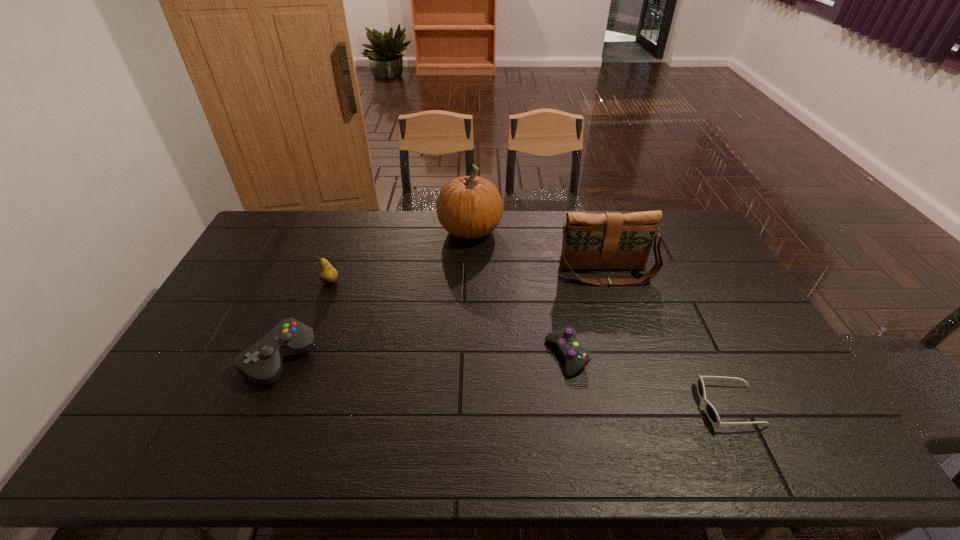
This screenshot has width=960, height=540. In order to click on free space located on the left of the pear in this screenshot , I will do `click(283, 282)`.

In order to click on blank space located 0.190m on the front of the left control in this screenshot , I will do `click(237, 461)`.

Find the location of a particular element. The width and height of the screenshot is (960, 540). vacant space situated 0.390m on the right of the right control is located at coordinates (726, 356).

I want to click on vacant space located 0.080m with the lenses of the shortest object facing outward, so click(669, 406).

Image resolution: width=960 pixels, height=540 pixels. What are the coordinates of `blank space located with the lenses of the shortest object facing outward` in the screenshot? It's located at (617, 406).

This screenshot has height=540, width=960. In order to click on free space located 0.120m with the lenses of the shortest object facing outward in this screenshot , I will do `click(653, 406)`.

Where is `object positioned at the far edge`? This screenshot has width=960, height=540. object positioned at the far edge is located at coordinates (469, 207).

Locate an element on the screen. Image resolution: width=960 pixels, height=540 pixels. object located at the near edge is located at coordinates (712, 414).

Identify the location of object that is at the right edge. This screenshot has height=540, width=960. (712, 414).

At what (x,y) coordinates should I click in order to perform the action: click on object positioned at the near right corner. Please return your answer as a coordinate pair (x, y). Looking at the image, I should click on (712, 414).